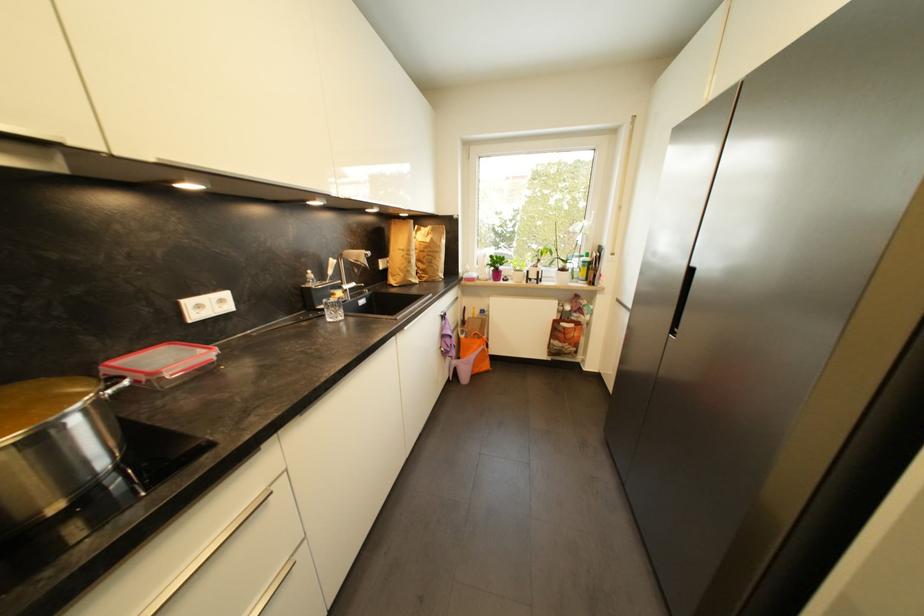
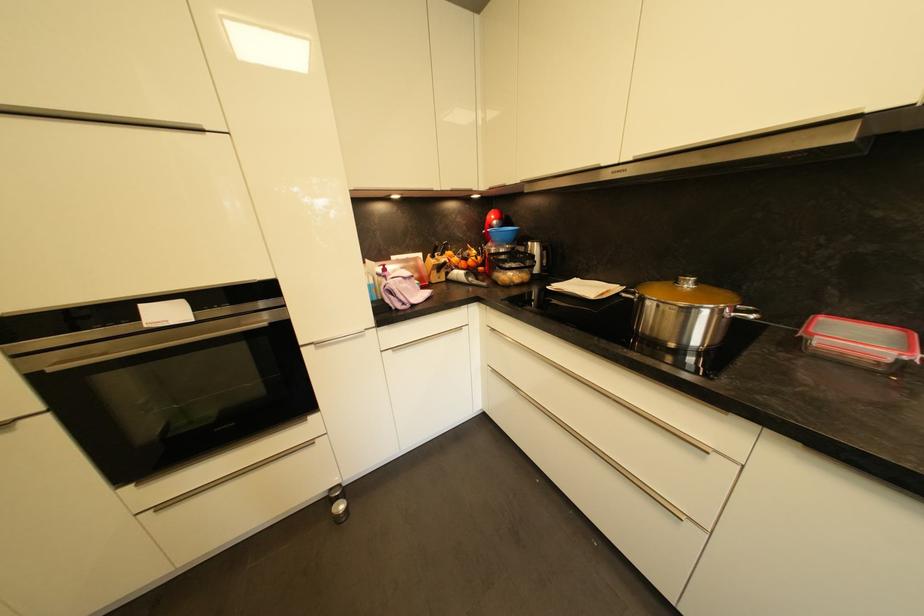
The point at (114, 361) is marked in the first image. Where is the corresponding point in the second image?

(836, 315)